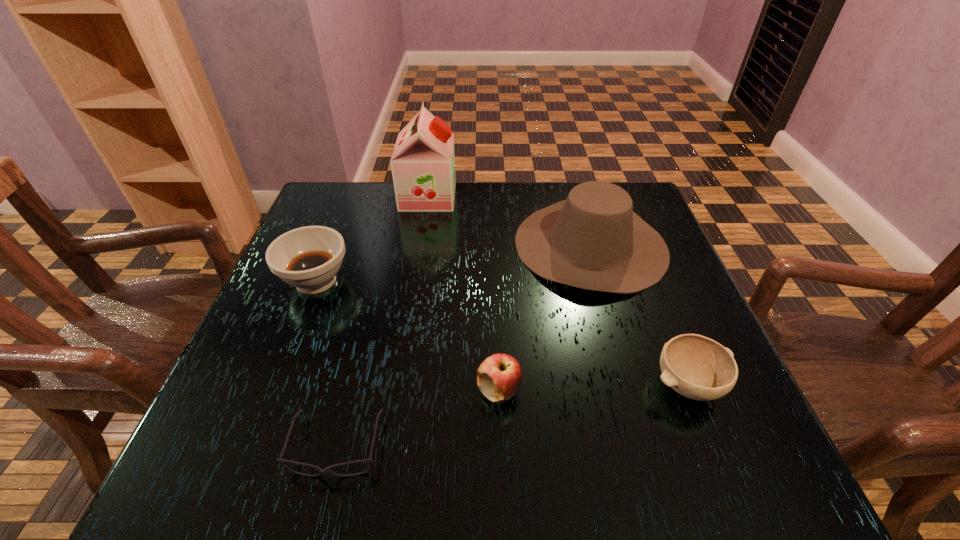
Locate an element on the screen. vacant space located 0.100m on the right of the apple is located at coordinates (578, 390).

Image resolution: width=960 pixels, height=540 pixels. What are the coordinates of `vacant space situated 0.120m on the left of the bowl` in the screenshot? It's located at (581, 384).

I want to click on soya milk that is at the far edge, so click(x=423, y=162).

The width and height of the screenshot is (960, 540). I want to click on cowboy hat situated at the far edge, so click(x=593, y=240).

At what (x,y) coordinates should I click in order to perform the action: click on object that is at the near edge. Please return your answer as a coordinate pair (x, y). The image size is (960, 540). Looking at the image, I should click on (327, 470).

Locate an element on the screen. This screenshot has width=960, height=540. soup bowl that is at the left edge is located at coordinates (308, 258).

This screenshot has height=540, width=960. Identify the location of spectacles located at the left edge. (327, 470).

The width and height of the screenshot is (960, 540). What are the coordinates of `cowboy hat positioned at the right edge` in the screenshot? It's located at (593, 240).

Where is `bowl at the right edge`? This screenshot has width=960, height=540. bowl at the right edge is located at coordinates (699, 368).

Image resolution: width=960 pixels, height=540 pixels. I want to click on object present at the near left corner, so click(x=327, y=470).